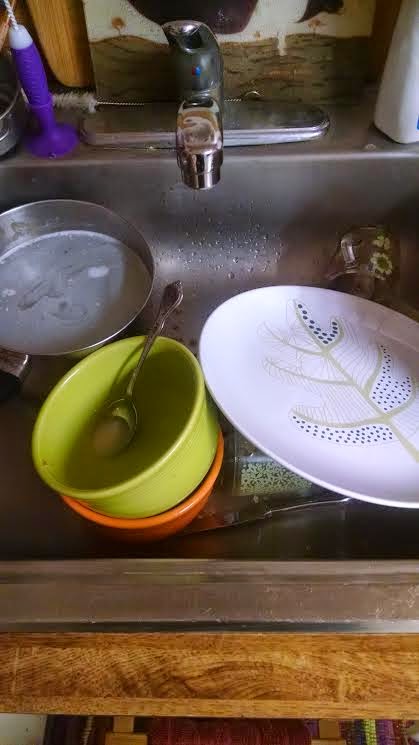
Identify the location of side of green bowl. Image resolution: width=419 pixels, height=745 pixels. (192, 468).